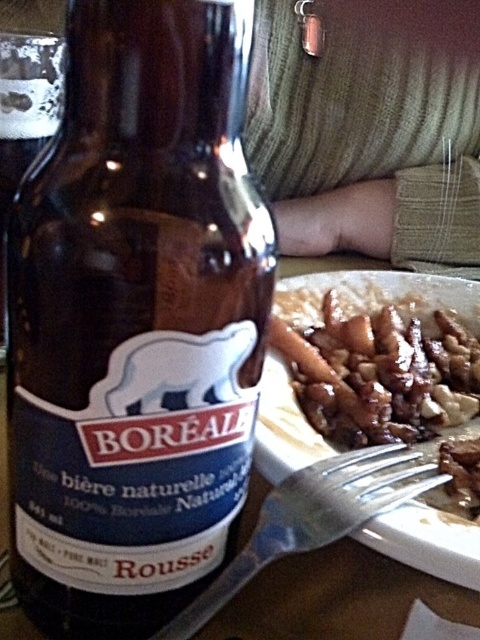
Question: Can you confirm if brown glass bottle at center is bigger than brown glossy pecans at plate center?

Choices:
 (A) yes
 (B) no

Answer: (B)

Question: Is brown glass bottle at center positioned in front of brown glossy pecans at plate center?

Choices:
 (A) yes
 (B) no

Answer: (A)

Question: Is brown glass bottle at center positioned before silver metallic fork at lower center?

Choices:
 (A) no
 (B) yes

Answer: (B)

Question: Among these objects, which one is farthest from the camera?

Choices:
 (A) brown glass bottle at center
 (B) silver metallic fork at lower center
 (C) brown glossy pecans at plate center

Answer: (C)

Question: Which point appears farthest from the camera in this image?

Choices:
 (A) (212, 589)
 (B) (336, 356)

Answer: (B)

Question: Which point appears farthest from the camera in this image?

Choices:
 (A) (218, 234)
 (B) (344, 506)

Answer: (B)